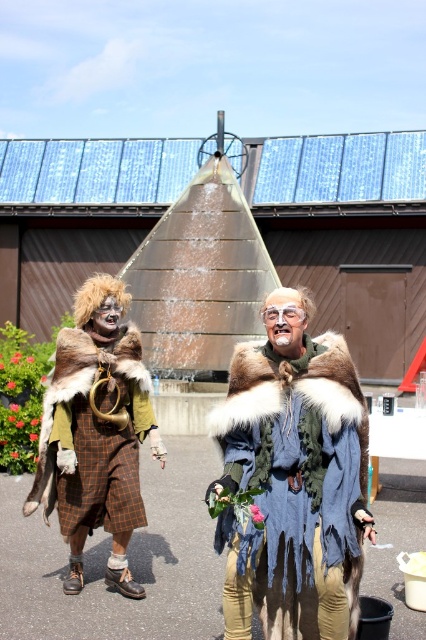
How distant is fur-coated robe at center from fur coat at left?

The distance of fur-coated robe at center from fur coat at left is 5.62 feet.

Is fur-coated robe at center to the right of fur coat at left from the viewer's perspective?

Yes, fur-coated robe at center is to the right of fur coat at left.

Image resolution: width=426 pixels, height=640 pixels. What do you see at coordinates (293, 477) in the screenshot?
I see `fur-coated robe at center` at bounding box center [293, 477].

Find the location of a particular element. fur-coated robe at center is located at coordinates (293, 477).